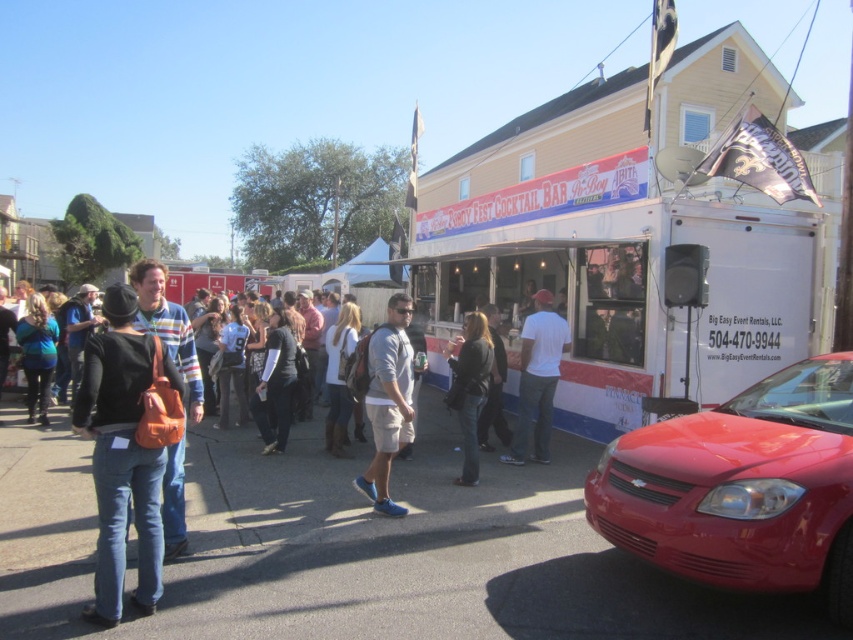
You are at the outdoor event and want to park your car. The shiny red sedan at lower right is currently occupying a spot. Is there enough space to park your car next to it?

The shiny red sedan at lower right is located at point (741, 486). Without knowing the exact dimensions of the parking area or the space between vehicles, it is impossible to determine if there is enough room to park next to it.